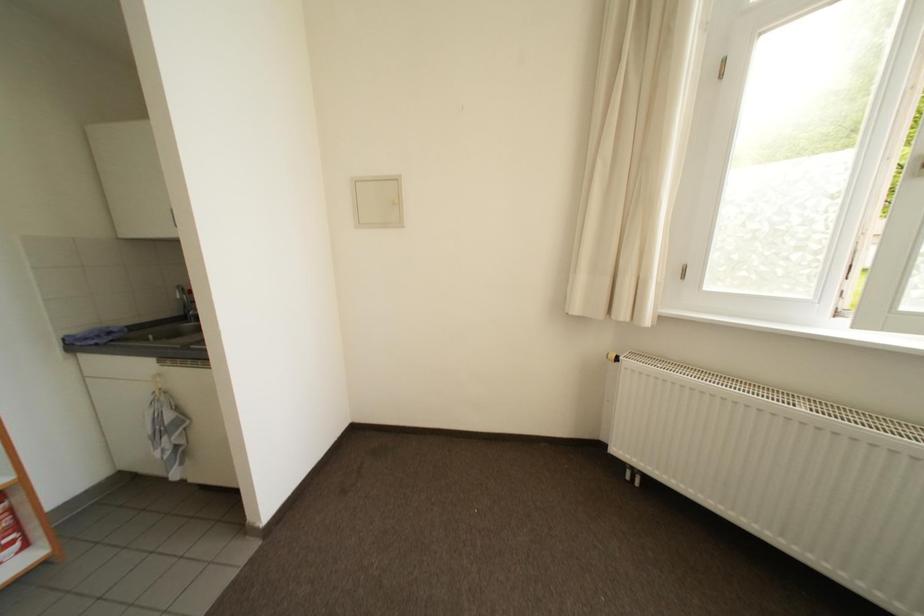
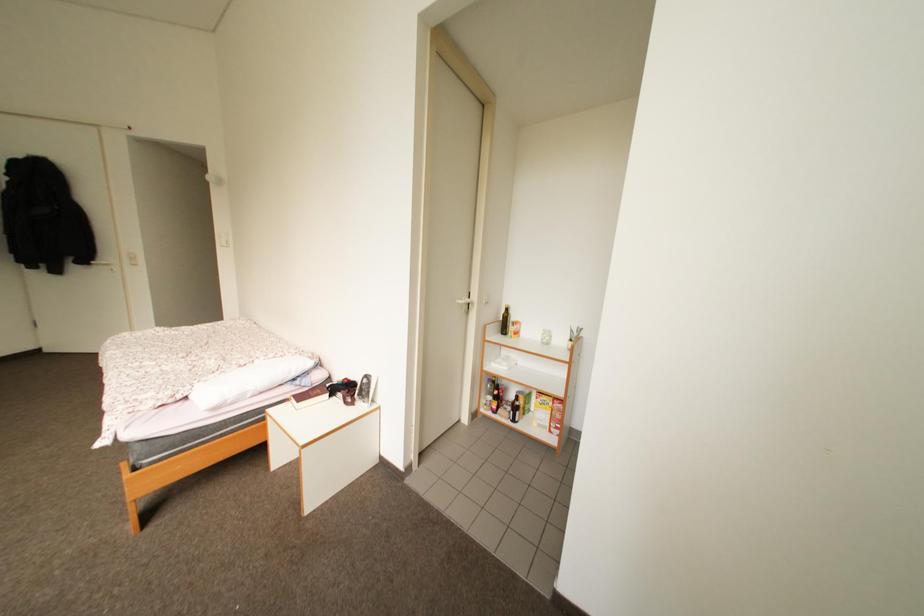
How did the camera likely rotate?

The rotation direction of the camera is left-down.